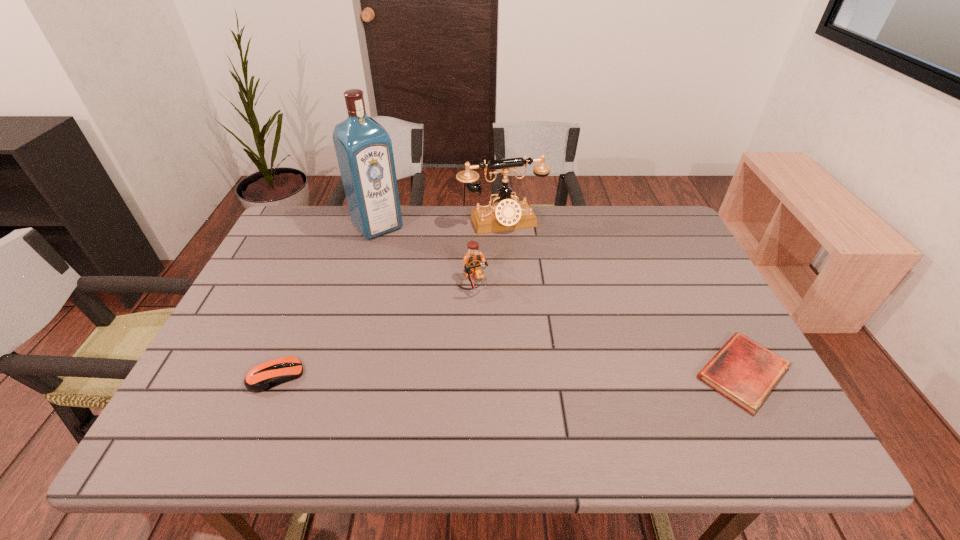
In the image, there is a desktop. At what (x,y) coordinates should I click in order to perform the action: click on vacant space at the far left corner. Please return your answer as a coordinate pair (x, y). Looking at the image, I should click on (294, 226).

This screenshot has height=540, width=960. Identify the location of free region at the near left corner of the desktop. (194, 389).

I want to click on empty location between the third shortest object and the shortest object, so click(609, 328).

The width and height of the screenshot is (960, 540). Identify the location of vacant area between the rightmost object and the second tallest object. (622, 297).

Where is `free space between the liquor and the shortest object`? The height and width of the screenshot is (540, 960). free space between the liquor and the shortest object is located at coordinates (560, 299).

Find the location of a particular element. This screenshot has width=960, height=540. free space between the third tallest object and the rightmost object is located at coordinates (609, 328).

Locate an element on the screen. The width and height of the screenshot is (960, 540). vacant space that is in between the telephone and the rightmost object is located at coordinates (622, 297).

The width and height of the screenshot is (960, 540). Identify the location of blank region between the third farthest object and the shortest object. (609, 328).

Where is `empty location between the fourth shortest object and the Lego`? empty location between the fourth shortest object and the Lego is located at coordinates (488, 252).

The image size is (960, 540). Find the location of `free area in between the liquor and the fourth shortest object`. free area in between the liquor and the fourth shortest object is located at coordinates (440, 224).